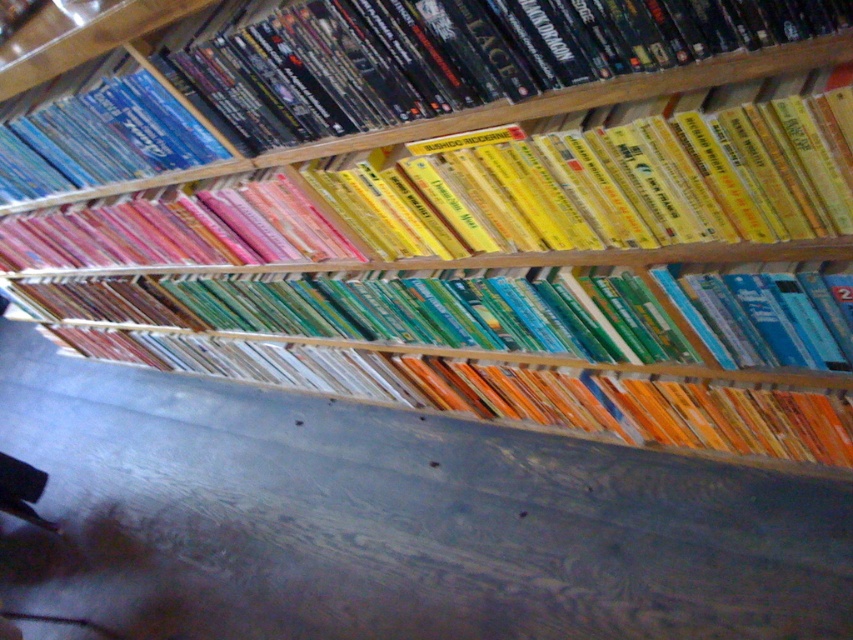
Question: Is matte black book at upper center positioned at the back of yellow matte book at upper center?

Choices:
 (A) yes
 (B) no

Answer: (B)

Question: From the image, what is the correct spatial relationship of matte black book at upper center in relation to blue glossy dvd at upper left?

Choices:
 (A) right
 (B) left

Answer: (A)

Question: Which point is closer to the camera taking this photo?

Choices:
 (A) (633, 122)
 (B) (9, 180)
 (C) (724, 16)

Answer: (C)

Question: Which point is farther from the camera taking this photo?

Choices:
 (A) (576, 150)
 (B) (9, 192)

Answer: (B)

Question: Is matte black book at upper center positioned at the back of blue glossy dvd at upper left?

Choices:
 (A) yes
 (B) no

Answer: (B)

Question: Which object is positioned farthest from the yellow matte book at upper center?

Choices:
 (A) blue glossy dvd at upper left
 (B) matte black book at upper center

Answer: (A)